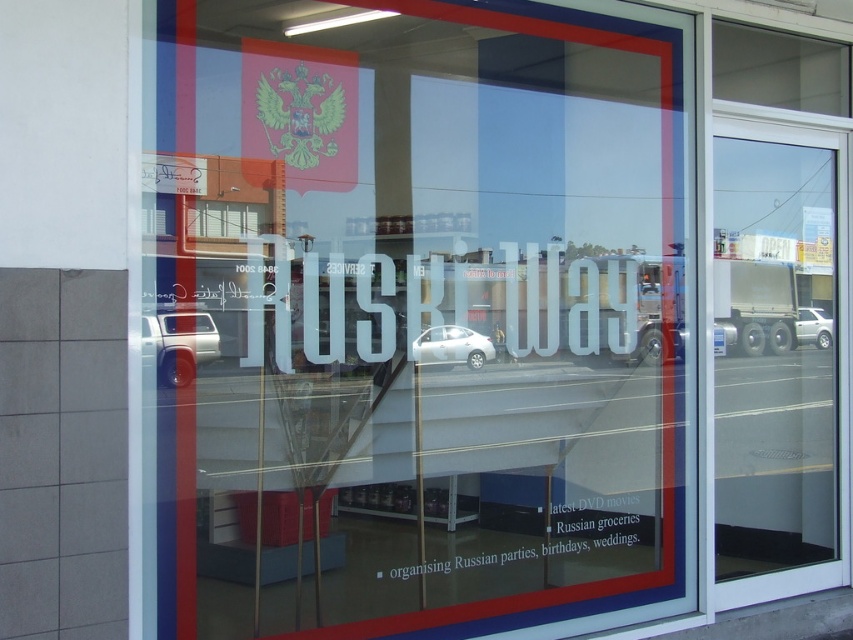
Is transparent glass sign at center in front of white glossy car at center?

Yes, transparent glass sign at center is closer to the viewer.

Is point (679, 529) in front of point (440, 340)?

No, it is not.

This screenshot has height=640, width=853. Find the location of `transparent glass sign at center`. transparent glass sign at center is located at coordinates (415, 316).

Who is higher up, silver metallic truck at left or white glossy car at center?

silver metallic truck at left

Can you confirm if silver metallic truck at left is wider than white glossy car at center?

Incorrect, silver metallic truck at left's width does not surpass white glossy car at center's.

In order to click on silver metallic truck at left in this screenshot , I will do `click(181, 344)`.

Between point (170, 321) and point (799, 307), which one is positioned in front?

Point (170, 321) is more forward.

Based on the photo, who is positioned more to the right, silver metallic truck at left or silver metallic car at right?

Positioned to the right is silver metallic car at right.

Which is in front, point (177, 316) or point (827, 332)?

Point (177, 316) is in front.

Locate an element on the screen. silver metallic truck at left is located at coordinates (181, 344).